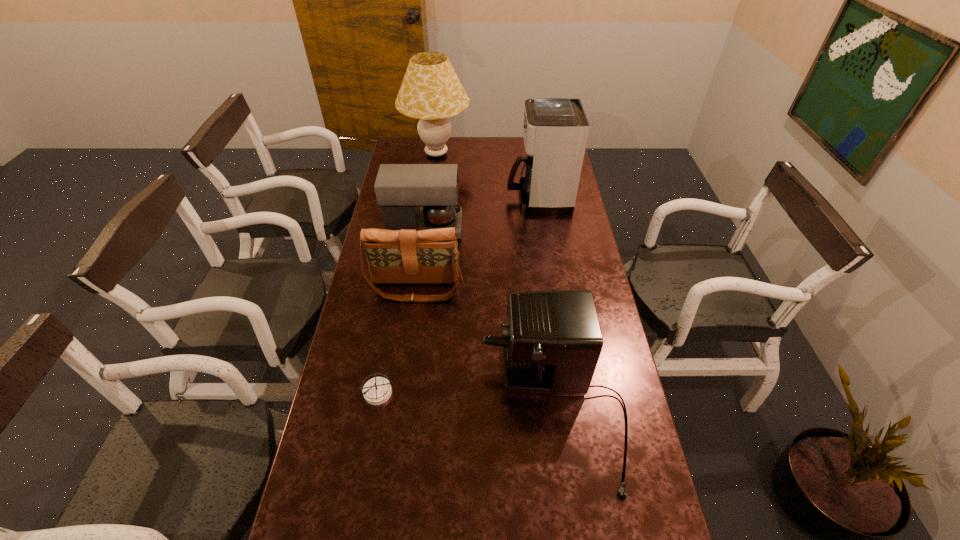
Find the location of `vacant space located on the front panel of the fifth nearest object`. vacant space located on the front panel of the fifth nearest object is located at coordinates (452, 198).

The height and width of the screenshot is (540, 960). I want to click on free space located 0.110m on the front panel of the fifth nearest object, so click(482, 198).

In order to click on free space located 0.060m on the front-facing side of the nearest coffee maker in this screenshot , I will do `click(462, 411)`.

Where is `vacant space situated on the front-facing side of the nearest coffee maker`? vacant space situated on the front-facing side of the nearest coffee maker is located at coordinates (437, 411).

Image resolution: width=960 pixels, height=540 pixels. Find the location of `vacant space positioned 0.250m on the front-facing side of the nearest coffee maker`. vacant space positioned 0.250m on the front-facing side of the nearest coffee maker is located at coordinates (394, 411).

You are a GUI agent. You are given a task and a screenshot of the screen. Output one action in this format:
    pyautogui.click(x=<x>, y=<y>)
    Task: Click on the free space located on the carafe side of the third farthest object
    This screenshot has width=960, height=540.
    Given the screenshot: What is the action you would take?
    pyautogui.click(x=555, y=227)

Where is `vacant region located on the front-facing side of the shoulder bag`? Image resolution: width=960 pixels, height=540 pixels. vacant region located on the front-facing side of the shoulder bag is located at coordinates (398, 411).

At what (x,y) coordinates should I click in order to perform the action: click on vacant space located on the right of the compass. Please return your answer as a coordinate pair (x, y). This screenshot has width=960, height=540. Looking at the image, I should click on (529, 392).

This screenshot has width=960, height=540. I want to click on object that is at the far edge, so click(x=431, y=91).

Locate an element on the screen. The height and width of the screenshot is (540, 960). lampshade situated at the left edge is located at coordinates tap(431, 91).